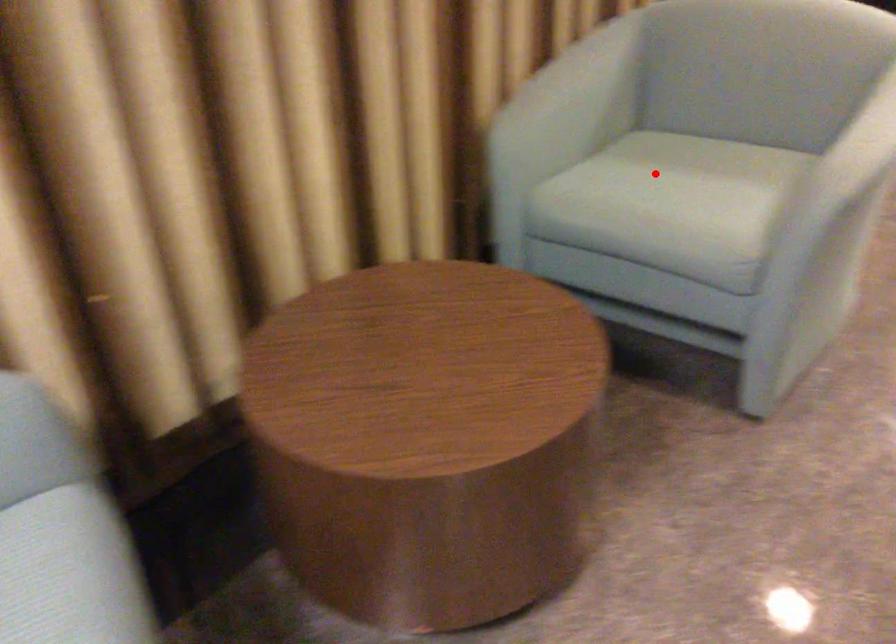
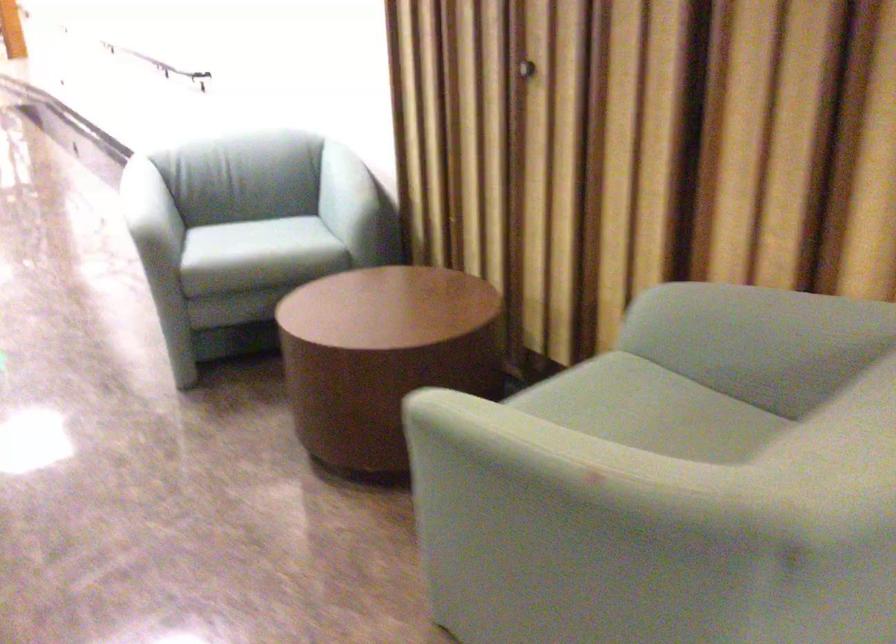
Question: I am providing you with two images of the same scene from different viewpoints. In image1, a red point is highlighted. Considering the same 3D point in image2, which of the following is correct?

Choices:
 (A) It is closer
 (B) It is farther

Answer: (A)